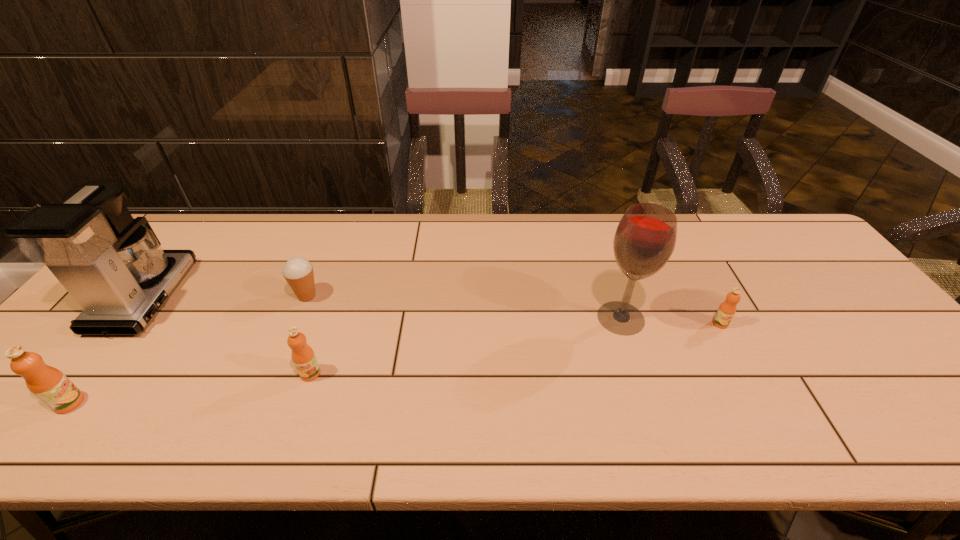
Where is `blank region between the coffee maker and the tallest orange juice`? This screenshot has height=540, width=960. blank region between the coffee maker and the tallest orange juice is located at coordinates (108, 350).

Locate which object ranks second in proximity to the third tallest object. Please provide its 2D coordinates. Your answer should be formatted as a tuple, i.e. [(x, y)], where the tuple contains the x and y coordinates of a point satisfying the conditions above.

[(298, 272)]

Identify which object is located as the fifth nearest to the third object from left to right. Please provide its 2D coordinates. Your answer should be formatted as a tuple, i.e. [(x, y)], where the tuple contains the x and y coordinates of a point satisfying the conditions above.

[(727, 309)]

Locate which orange juice ranks in proximity to the coffee maker. Please provide its 2D coordinates. Your answer should be formatted as a tuple, i.e. [(x, y)], where the tuple contains the x and y coordinates of a point satisfying the conditions above.

[(48, 384)]

Identify the location of orange juice that is the third nearest to the icecream. (727, 309).

I want to click on vacant space that satisfies the following two spatial constraints: 1. on the front label of the third object from right to left; 2. on the front label of the nearest orange juice, so 300,403.

Where is `free space in the image that satisfies the following two spatial constraints: 1. at the front of the alcohol where the controls are located; 2. on the right side of the coffee maker`? The width and height of the screenshot is (960, 540). free space in the image that satisfies the following two spatial constraints: 1. at the front of the alcohol where the controls are located; 2. on the right side of the coffee maker is located at coordinates (129, 318).

Find the location of a particular element. vacant space that satisfies the following two spatial constraints: 1. on the front side of the second object from right to left; 2. on the right side of the third object from left to right is located at coordinates (298, 318).

Image resolution: width=960 pixels, height=540 pixels. Identify the location of vacant area in the image that satisfies the following two spatial constraints: 1. on the front label of the rightmost orange juice; 2. on the front label of the leftmost orange juice. (763, 403).